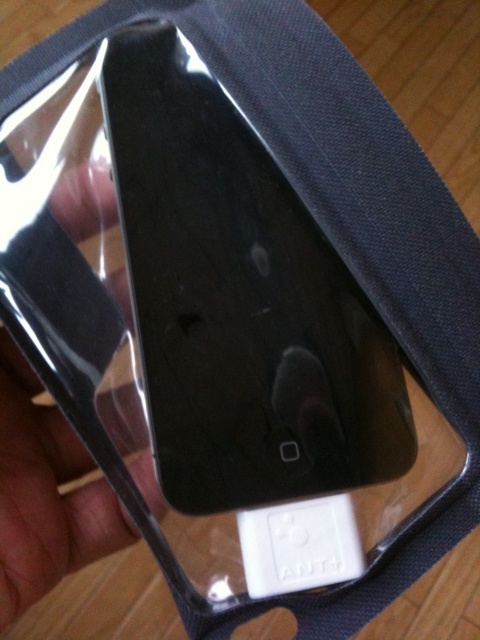
Question: Is transparent plastic hand at center thinner than white plastic ipod at center?

Choices:
 (A) no
 (B) yes

Answer: (A)

Question: Considering the relative positions of transparent plastic hand at center and white plastic ipod at center in the image provided, where is transparent plastic hand at center located with respect to white plastic ipod at center?

Choices:
 (A) below
 (B) above

Answer: (B)

Question: Among these points, which one is farthest from the camera?

Choices:
 (A) (279, 593)
 (B) (127, 605)

Answer: (B)

Question: Does transparent plastic hand at center appear on the left side of white plastic ipod at center?

Choices:
 (A) no
 (B) yes

Answer: (B)

Question: Which object appears closest to the camera in this image?

Choices:
 (A) transparent plastic hand at center
 (B) white plastic ipod at center

Answer: (A)